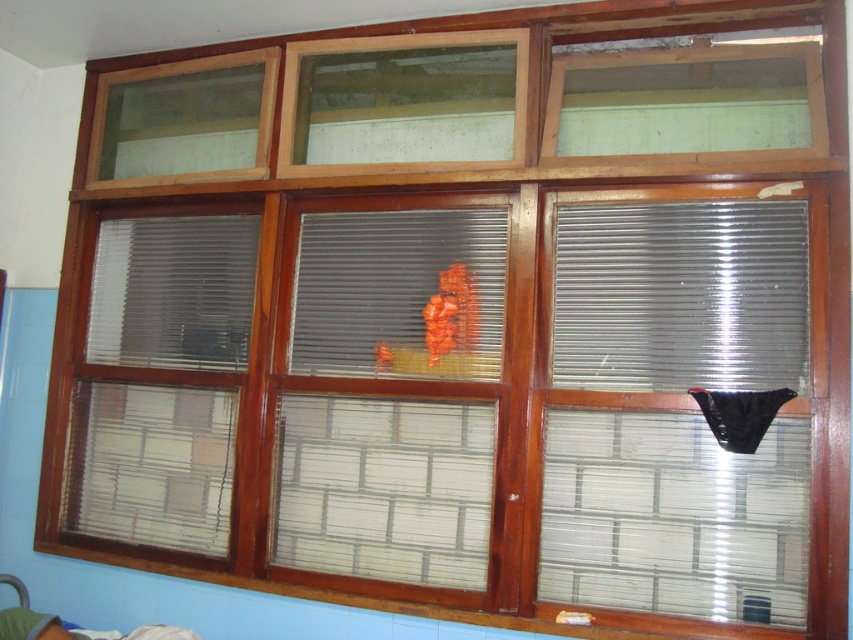
Does translucent plastic blind at center appear over green fabric bed at lower left?

Indeed, translucent plastic blind at center is positioned over green fabric bed at lower left.

Which is below, translucent plastic blind at center or green fabric bed at lower left?

Positioned lower is green fabric bed at lower left.

Where is `translucent plastic blind at center`? The image size is (853, 640). translucent plastic blind at center is located at coordinates (399, 292).

Is point (643, 257) farther from camera compared to point (62, 634)?

That is True.

Between metallic corrugated blind at right and green fabric bed at lower left, which one appears on the right side from the viewer's perspective?

metallic corrugated blind at right is more to the right.

Who is more forward, (x=785, y=308) or (x=32, y=636)?

Point (x=32, y=636) is in front.

Where is `metallic corrugated blind at right`? Image resolution: width=853 pixels, height=640 pixels. metallic corrugated blind at right is located at coordinates (682, 296).

How much distance is there between metallic corrugated blind at right and translucent plastic blind at center?

metallic corrugated blind at right and translucent plastic blind at center are 19.82 inches apart.

The height and width of the screenshot is (640, 853). What do you see at coordinates (682, 296) in the screenshot? I see `metallic corrugated blind at right` at bounding box center [682, 296].

Where is `metallic corrugated blind at right`? The image size is (853, 640). metallic corrugated blind at right is located at coordinates (682, 296).